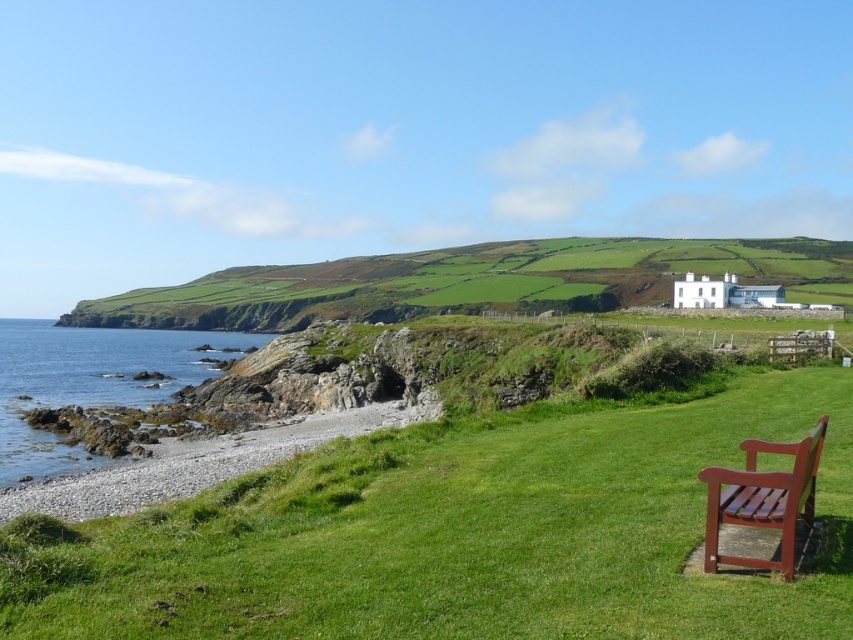
Does point (508, 605) come closer to viewer compared to point (15, 326)?

Yes, it is.

How distant is green grassy at lower right from gray rocky water at lower left?

green grassy at lower right and gray rocky water at lower left are 50.16 meters apart.

Who is more distant from viewer, (x=830, y=541) or (x=80, y=392)?

The point (x=80, y=392) is more distant.

The height and width of the screenshot is (640, 853). Find the location of `green grassy at lower right`. green grassy at lower right is located at coordinates (474, 531).

This screenshot has width=853, height=640. Find the location of `green grassy at lower right`. green grassy at lower right is located at coordinates (474, 531).

Can you confirm if green grassy at lower right is thinner than green grassy hillside at upper center?

Indeed, green grassy at lower right has a lesser width compared to green grassy hillside at upper center.

Identify the location of green grassy at lower right. The image size is (853, 640). (474, 531).

Identify the location of green grassy at lower right. (474, 531).

Which of these two, green grassy hillside at upper center or smooth pebbles at lower left, stands shorter?

With less height is smooth pebbles at lower left.

Is green grassy hillside at upper center wider than smooth pebbles at lower left?

Yes.

Is point (720, 266) farther from viewer compared to point (56, 499)?

Yes, point (720, 266) is behind point (56, 499).

Locate an element on the screen. green grassy hillside at upper center is located at coordinates (473, 282).